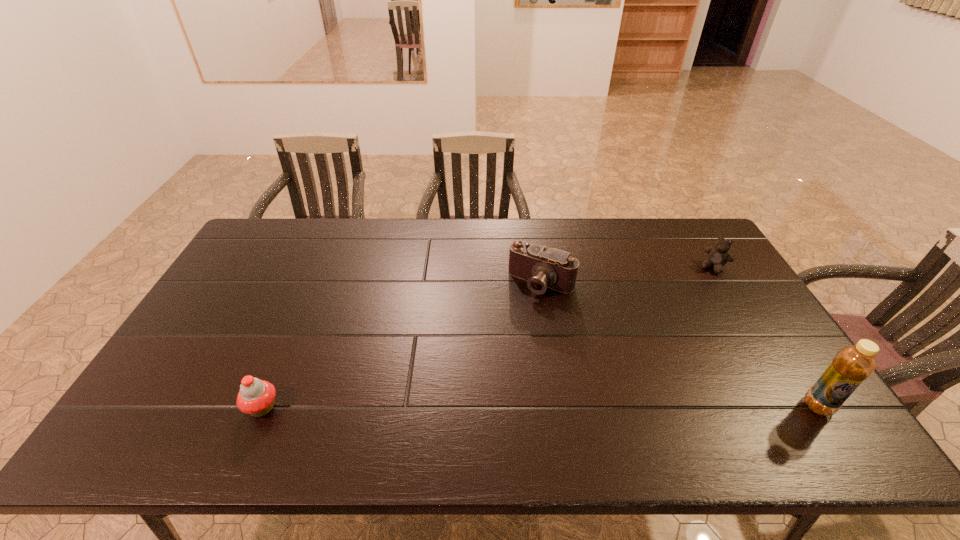
In the image, there is a desktop. Where is `vacant space at the near edge`? vacant space at the near edge is located at coordinates (287, 408).

The height and width of the screenshot is (540, 960). In order to click on blank space at the left edge of the desktop in this screenshot , I will do `click(266, 285)`.

Where is `vacant region at the right edge of the desktop`? The width and height of the screenshot is (960, 540). vacant region at the right edge of the desktop is located at coordinates (753, 339).

Identify the location of vacant space at the near left corner of the desktop. The width and height of the screenshot is (960, 540). (181, 408).

Find the location of a particular element. The width and height of the screenshot is (960, 540). vacant space at the far right corner of the desktop is located at coordinates (698, 251).

Identify the location of free area in between the cupcake and the bottle. The image size is (960, 540). (540, 407).

Identify the location of unoccupied position between the camera and the tallest object. The width and height of the screenshot is (960, 540). (680, 345).

The width and height of the screenshot is (960, 540). Find the location of `free space between the teddy bear and the tallest object`. free space between the teddy bear and the tallest object is located at coordinates (766, 336).

Where is `free point between the leftmost object and the tallest object`? This screenshot has width=960, height=540. free point between the leftmost object and the tallest object is located at coordinates (540, 407).

This screenshot has height=540, width=960. Identify the location of free space that is in between the camera and the cupcake. (401, 345).